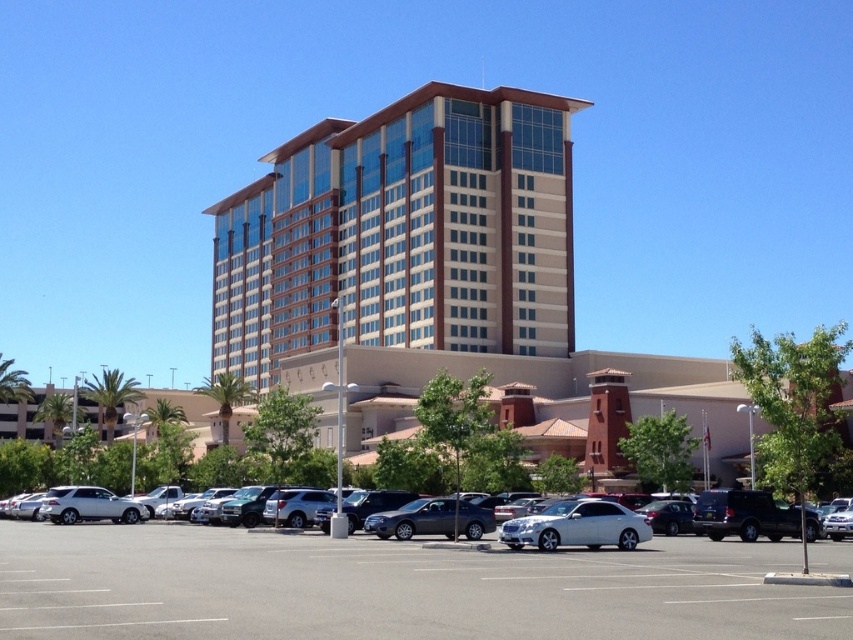
You are standing in front of the building and want to walk to the white glossy sedan at center. Which direction should you move relative to the gray asphalt parking lot at lower center?

Since the gray asphalt parking lot at lower center is closer to you than the white glossy sedan at center, you should move away from the gray asphalt parking lot at lower center to reach the white glossy sedan at center.